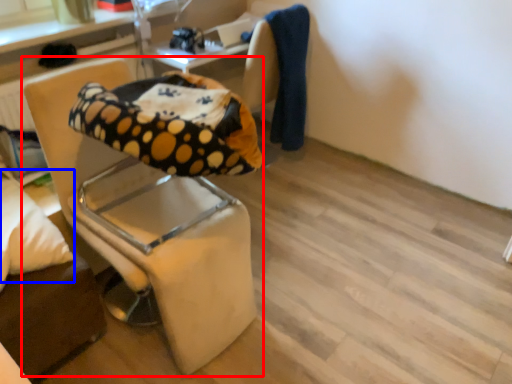
Question: Among these objects, which one is farthest to the camera, chair (highlighted by a red box) or pillow (highlighted by a blue box)?

Choices:
 (A) chair
 (B) pillow

Answer: (B)